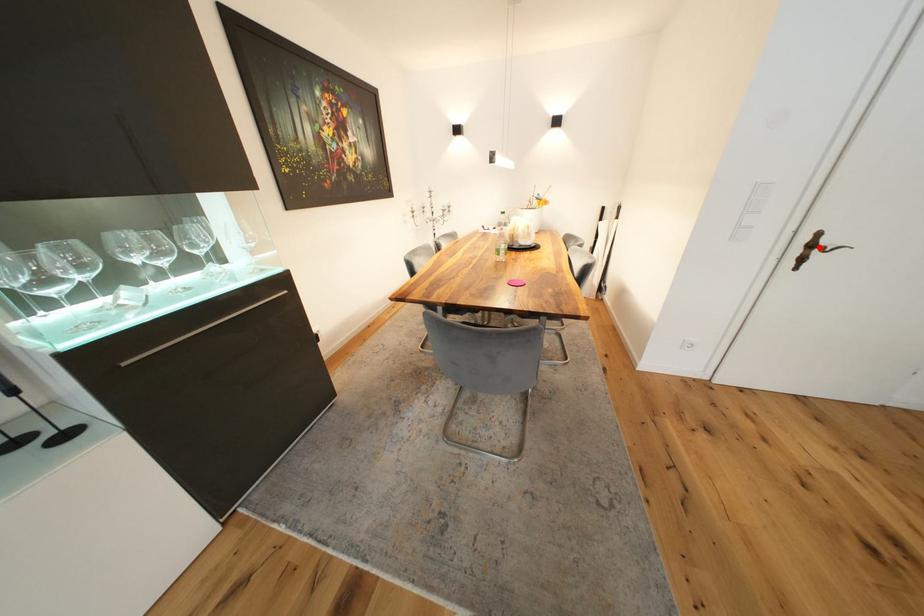
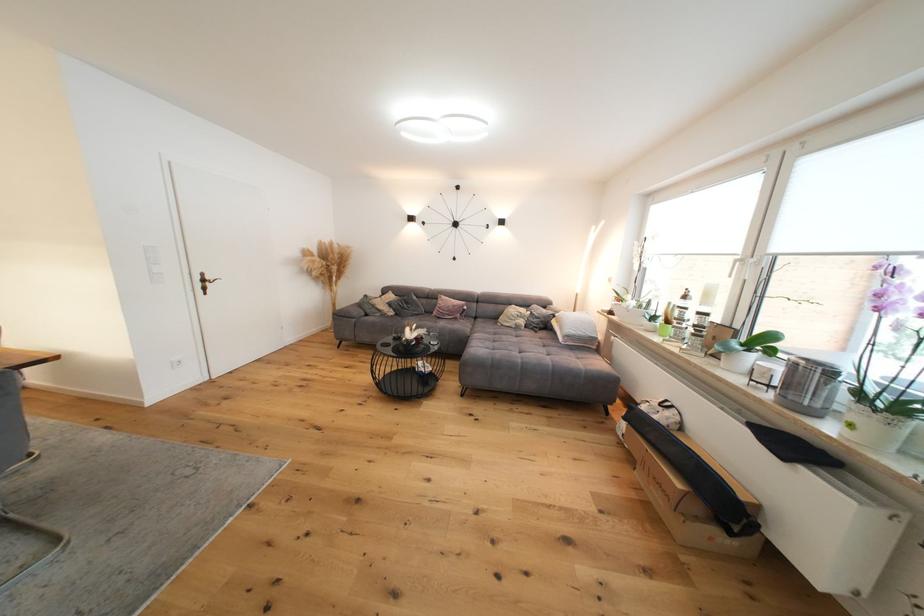
Find the pixel in the second image that matches the highlighted location in the first image.

(211, 282)